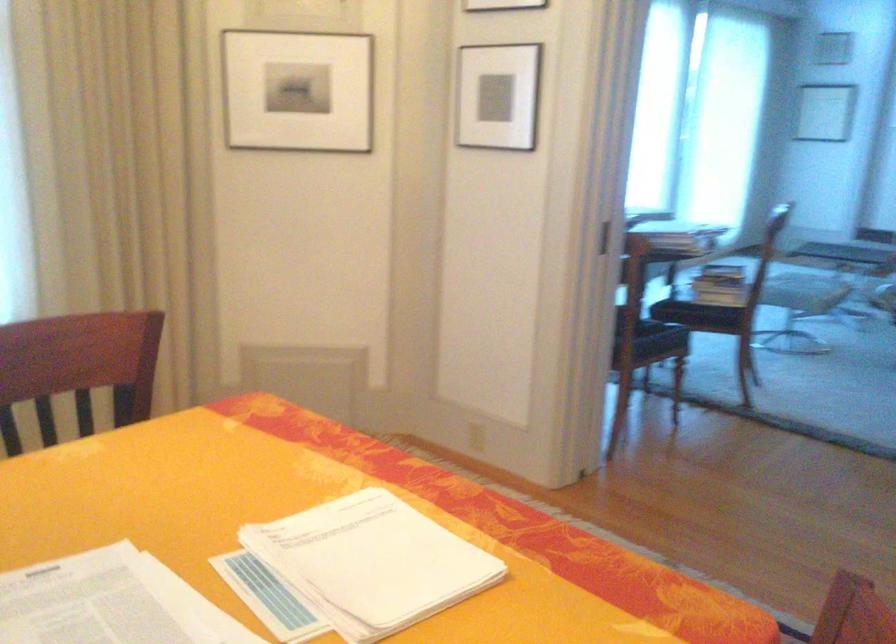
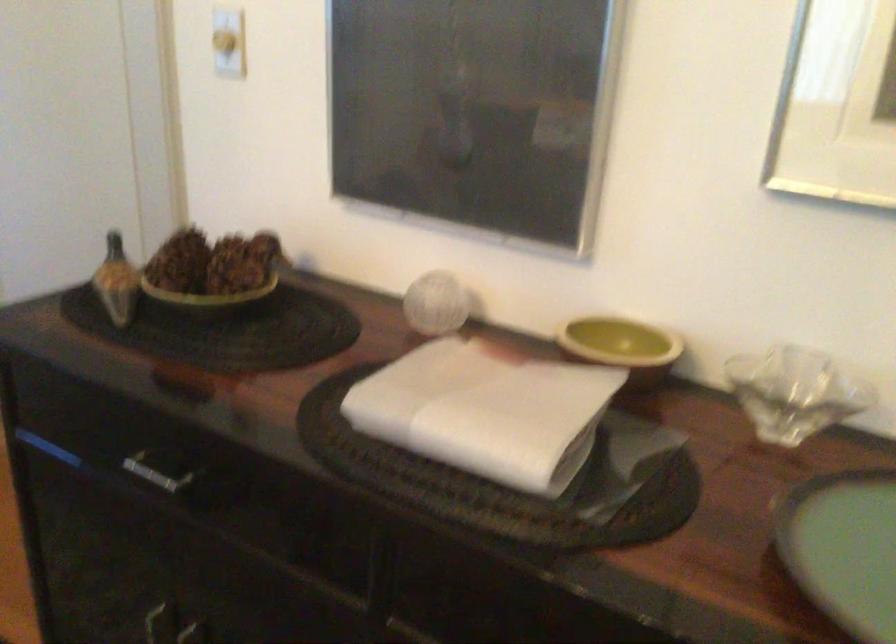
The first image is from the beginning of the video and the second image is from the end. How did the camera likely rotate when shooting the video?

The rotation direction of the camera is right-down.